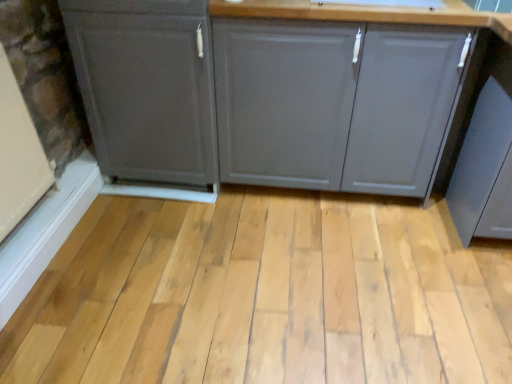
The width and height of the screenshot is (512, 384). What do you see at coordinates (265, 295) in the screenshot? I see `natural wood plank at center` at bounding box center [265, 295].

Image resolution: width=512 pixels, height=384 pixels. In order to click on matte gray cabinet at left, which is counted as the second cabinetry, starting from the right in this screenshot , I will do `click(147, 87)`.

Could you tell me if matte gray cabinet at left, which is counted as the second cabinetry, starting from the right, is turned towards matte gray cabinet at center, positioned as the 1th cabinetry in right-to-left order?

No, matte gray cabinet at left, which is counted as the second cabinetry, starting from the right, is not facing towards matte gray cabinet at center, positioned as the 1th cabinetry in right-to-left order.

Is matte gray cabinet at left, the first cabinetry viewed from the left, wider or thinner than matte gray cabinet at center, the 2th cabinetry positioned from the left?

In the image, matte gray cabinet at left, the first cabinetry viewed from the left, appears to be wider than matte gray cabinet at center, the 2th cabinetry positioned from the left.

How far apart are matte gray cabinet at left, which is counted as the second cabinetry, starting from the right, and matte gray cabinet at center, positioned as the 1th cabinetry in right-to-left order?

matte gray cabinet at left, which is counted as the second cabinetry, starting from the right, and matte gray cabinet at center, positioned as the 1th cabinetry in right-to-left order, are 7.64 inches apart.

Does matte gray cabinet at center, the 2th cabinetry positioned from the left, turn towards natural wood plank at center?

Yes, matte gray cabinet at center, the 2th cabinetry positioned from the left, is aimed at natural wood plank at center.

Which point is more forward, (372, 170) or (381, 207)?

The point (372, 170) is more forward.

From a real-world perspective, is matte gray cabinet at center, the 2th cabinetry positioned from the left, physically below natural wood plank at center?

No.

How many degrees apart are the facing directions of matte gray cabinet at center, the 2th cabinetry positioned from the left, and natural wood plank at center?

0.122 degrees.

Which object is closer to the camera taking this photo, natural wood plank at center or matte gray cabinet at center, the 2th cabinetry positioned from the left?

natural wood plank at center is closer to the camera.

Considering the relative sizes of natural wood plank at center and matte gray cabinet at center, positioned as the 1th cabinetry in right-to-left order, in the image provided, is natural wood plank at center bigger than matte gray cabinet at center, positioned as the 1th cabinetry in right-to-left order,?

Incorrect, natural wood plank at center is not larger than matte gray cabinet at center, positioned as the 1th cabinetry in right-to-left order.

You are a GUI agent. You are given a task and a screenshot of the screen. Output one action in this format:
    pyautogui.click(x=<x>, y=<y>)
    Task: Click on the plank that is below the matte gray cabinet at center, positioned as the 1th cabinetry in right-to-left order (from the image's perspective)
    The image size is (512, 384).
    Given the screenshot: What is the action you would take?
    pyautogui.click(x=265, y=295)

Considering the positions of point (272, 66) and point (195, 89), is point (272, 66) closer or farther from the camera than point (195, 89)?

Point (272, 66) is positioned closer to the camera compared to point (195, 89).

Where is `cabinetry on the right of matte gray cabinet at left, which is counted as the second cabinetry, starting from the right`? The width and height of the screenshot is (512, 384). cabinetry on the right of matte gray cabinet at left, which is counted as the second cabinetry, starting from the right is located at coordinates (335, 103).

Is matte gray cabinet at center, positioned as the 1th cabinetry in right-to-left order, bigger than matte gray cabinet at left, the first cabinetry viewed from the left?

Correct, matte gray cabinet at center, positioned as the 1th cabinetry in right-to-left order, is larger in size than matte gray cabinet at left, the first cabinetry viewed from the left.

In the image, is matte gray cabinet at left, which is counted as the second cabinetry, starting from the right, on the left side or the right side of natural wood plank at center?

From the image, it's evident that matte gray cabinet at left, which is counted as the second cabinetry, starting from the right, is to the left of natural wood plank at center.

From the picture: Is matte gray cabinet at left, which is counted as the second cabinetry, starting from the right, closer to camera compared to natural wood plank at center?

No, matte gray cabinet at left, which is counted as the second cabinetry, starting from the right, is further to the viewer.

Is matte gray cabinet at left, the first cabinetry viewed from the left, beside natural wood plank at center?

No, matte gray cabinet at left, the first cabinetry viewed from the left, is not making contact with natural wood plank at center.

In terms of size, does matte gray cabinet at left, the first cabinetry viewed from the left, appear bigger or smaller than natural wood plank at center?

matte gray cabinet at left, the first cabinetry viewed from the left, is bigger than natural wood plank at center.

Can you confirm if natural wood plank at center is shorter than matte gray cabinet at left, the first cabinetry viewed from the left?

Yes, natural wood plank at center is shorter than matte gray cabinet at left, the first cabinetry viewed from the left.

Based on the photo, from the image's perspective, between natural wood plank at center and matte gray cabinet at left, the first cabinetry viewed from the left, who is located below?

natural wood plank at center is shown below in the image.

The image size is (512, 384). I want to click on cabinetry that is the 2nd one when counting upward from the natural wood plank at center (from the image's perspective), so click(x=147, y=87).

Locate an element on the screen. cabinetry that appears above the matte gray cabinet at center, positioned as the 1th cabinetry in right-to-left order (from a real-world perspective) is located at coordinates (147, 87).

I want to click on cabinetry on the right of the natural wood plank at center, so click(x=335, y=103).

Based on the photo, when comparing their distances from matte gray cabinet at left, the first cabinetry viewed from the left, does matte gray cabinet at center, the 2th cabinetry positioned from the left, or natural wood plank at center seem further?

natural wood plank at center is positioned further to the anchor matte gray cabinet at left, the first cabinetry viewed from the left.

Looking at the image, which one is located closer to matte gray cabinet at left, which is counted as the second cabinetry, starting from the right, natural wood plank at center or matte gray cabinet at center, the 2th cabinetry positioned from the left?

Based on the image, matte gray cabinet at center, the 2th cabinetry positioned from the left, appears to be nearer to matte gray cabinet at left, which is counted as the second cabinetry, starting from the right.

When comparing their distances from natural wood plank at center, does matte gray cabinet at left, which is counted as the second cabinetry, starting from the right, or matte gray cabinet at center, positioned as the 1th cabinetry in right-to-left order, seem further?

matte gray cabinet at left, which is counted as the second cabinetry, starting from the right, is further to natural wood plank at center.

Looking at the image, which one is located closer to matte gray cabinet at center, positioned as the 1th cabinetry in right-to-left order, natural wood plank at center or matte gray cabinet at left, the first cabinetry viewed from the left?

The object closer to matte gray cabinet at center, positioned as the 1th cabinetry in right-to-left order, is matte gray cabinet at left, the first cabinetry viewed from the left.

Estimate the real-world distances between objects in this image. Which object is further from matte gray cabinet at center, the 2th cabinetry positioned from the left, matte gray cabinet at left, which is counted as the second cabinetry, starting from the right, or natural wood plank at center?

natural wood plank at center is further to matte gray cabinet at center, the 2th cabinetry positioned from the left.

Considering their positions, is matte gray cabinet at center, positioned as the 1th cabinetry in right-to-left order, positioned further to natural wood plank at center than matte gray cabinet at left, the first cabinetry viewed from the left?

The object further to natural wood plank at center is matte gray cabinet at left, the first cabinetry viewed from the left.

You are a GUI agent. You are given a task and a screenshot of the screen. Output one action in this format:
    pyautogui.click(x=<x>, y=<y>)
    Task: Click on the cabinetry that lies between matte gray cabinet at left, which is counted as the second cabinetry, starting from the right, and natural wood plank at center from top to bottom
    
    Given the screenshot: What is the action you would take?
    pyautogui.click(x=335, y=103)